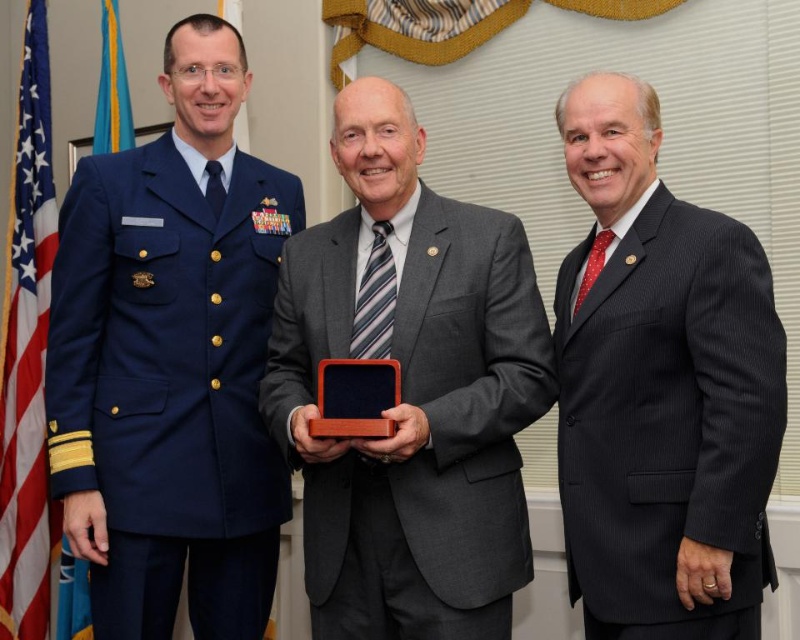
Does navy blue wool military uniform at left have a greater height compared to blue fabric flag at left?

Yes.

Who is lower down, navy blue wool military uniform at left or blue fabric flag at left?

blue fabric flag at left is lower down.

Does point (173, 163) come behind point (110, 80)?

That is False.

At what (x,y) coordinates should I click in order to perform the action: click on navy blue wool military uniform at left. Please return your answer as a coordinate pair (x, y). Looking at the image, I should click on (166, 349).

Can you confirm if dark gray pinstripe suit at center is taller than blue fabric flag at left?

Yes.

Which is more to the left, dark gray pinstripe suit at center or blue fabric flag at left?

blue fabric flag at left is more to the left.

Which is behind, point (774, 349) or point (76, 608)?

Positioned behind is point (76, 608).

This screenshot has height=640, width=800. I want to click on dark gray pinstripe suit at center, so click(668, 412).

Does matte gray suit at center appear on the right side of red fabric flag at left?

Indeed, matte gray suit at center is positioned on the right side of red fabric flag at left.

Is point (524, 323) behind point (18, 413)?

No, (524, 323) is closer to viewer.

I want to click on matte gray suit at center, so click(468, 396).